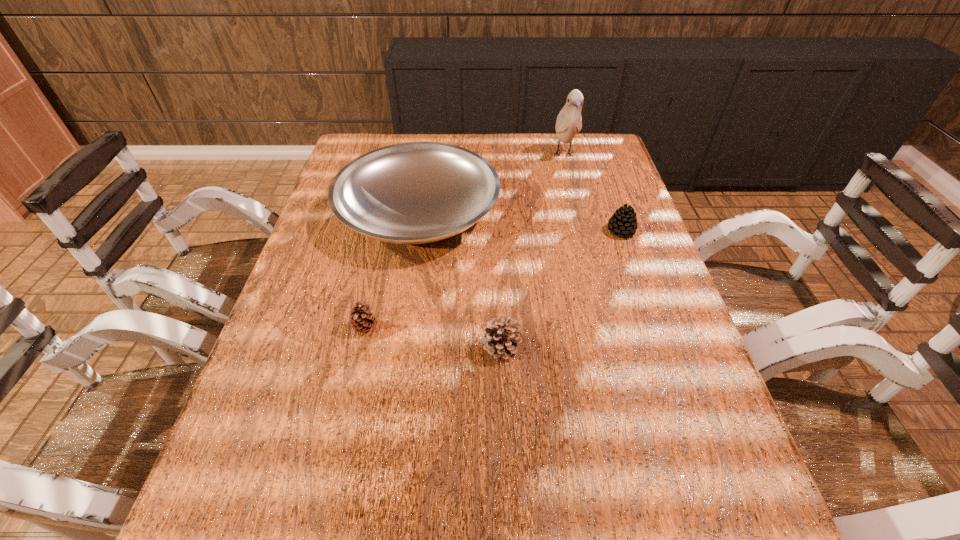
Locate an element on the screen. object present at the far right corner is located at coordinates (569, 121).

Image resolution: width=960 pixels, height=540 pixels. In order to click on free space at the far edge of the desktop in this screenshot , I will do `click(546, 157)`.

The height and width of the screenshot is (540, 960). In the image, there is a desktop. Find the location of `vacant area at the near edge`. vacant area at the near edge is located at coordinates (459, 534).

At what (x,y) coordinates should I click in order to perform the action: click on free space at the left edge. Please return your answer as a coordinate pair (x, y). Looking at the image, I should click on (319, 258).

Identify the location of free space at the right edge. (600, 210).

Find the location of a particular element. vacant space at the far left corner of the desktop is located at coordinates (373, 136).

Identify the location of blank area at the far right corner. (581, 170).

At what (x,y) coordinates should I click in order to perform the action: click on empty location between the leftmost pinecone and the bedpan. Please return your answer as a coordinate pair (x, y). Looking at the image, I should click on (392, 269).

Locate an element on the screen. vacant space that is in between the rightmost object and the leftmost pinecone is located at coordinates [x=492, y=279].

Identify the location of unoccupied position between the bedpan and the rightmost object. Image resolution: width=960 pixels, height=540 pixels. (519, 221).